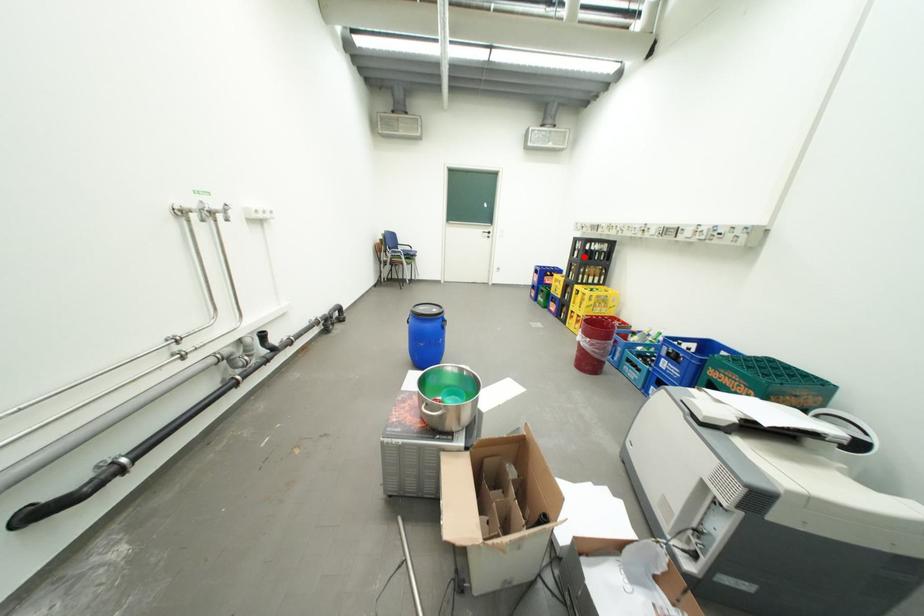
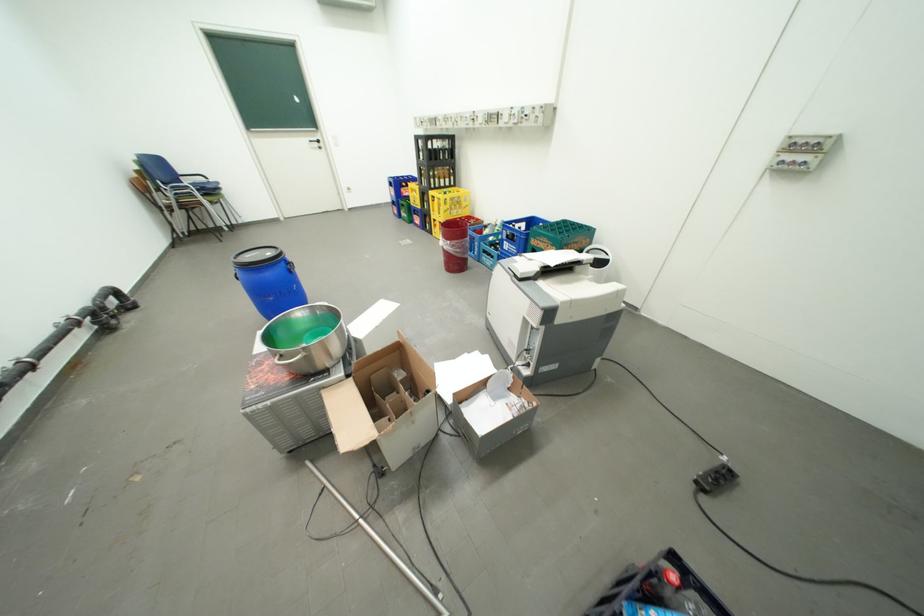
The point at the highlighted location is marked in the first image. Where is the corresponding point in the second image?

(430, 159)